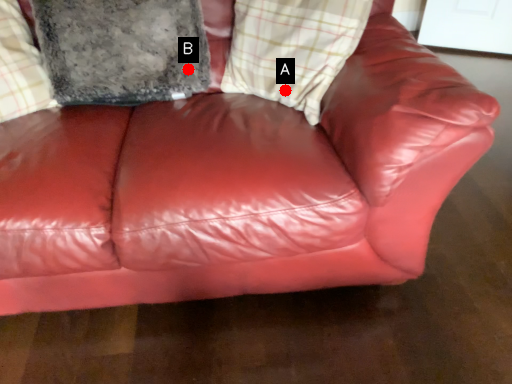
Question: Two points are circled on the image, labeled by A and B beside each circle. Which of the following is the farthest from the observer?

Choices:
 (A) A is further
 (B) B is further

Answer: (B)